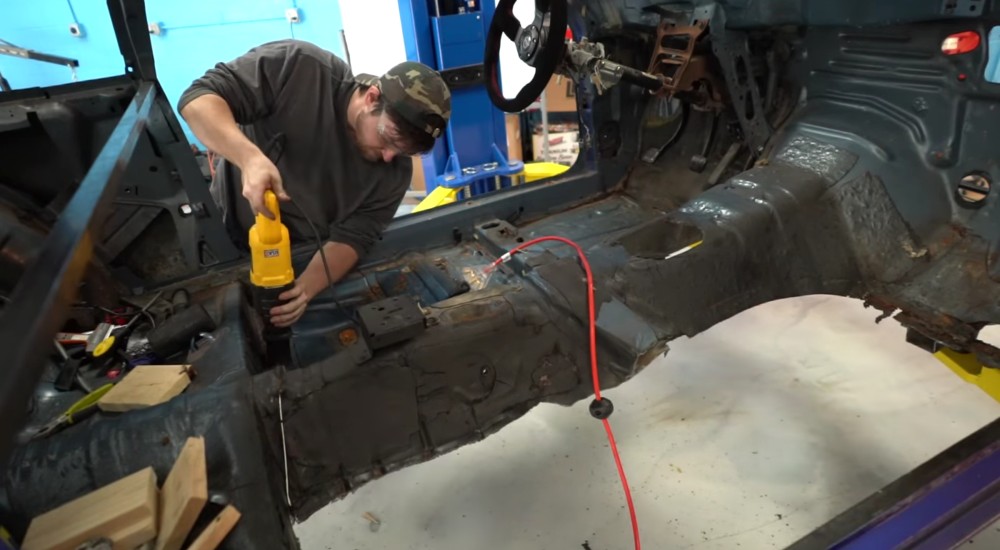
Image resolution: width=1000 pixels, height=550 pixels. What are the coordinates of `wall` in the screenshot? It's located at (347, 35).